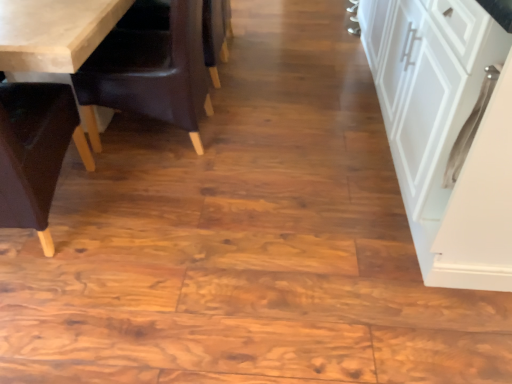
Locate an element on the screen. The width and height of the screenshot is (512, 384). free spot in front of brown leather chair at left, placed as the second chair when sorted from left to right is located at coordinates (160, 194).